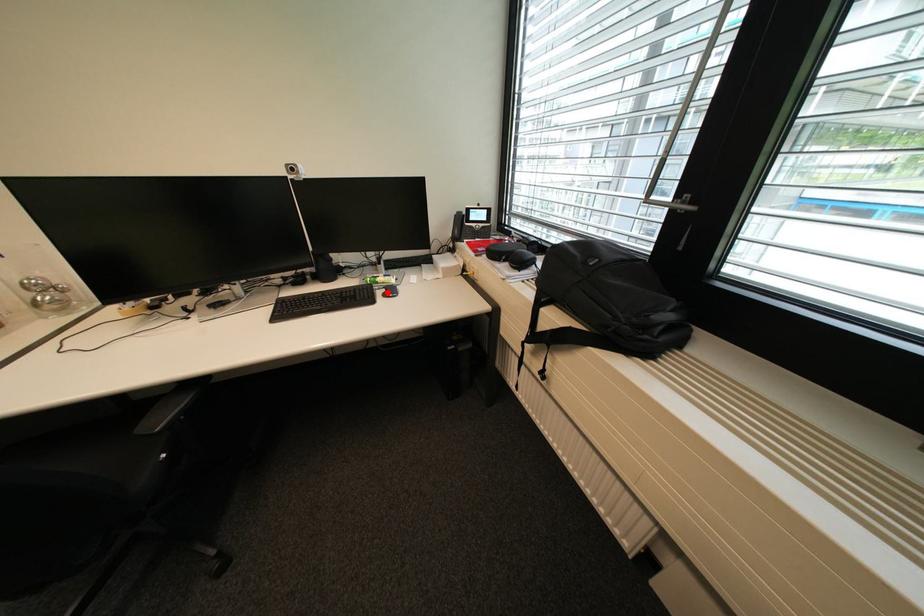
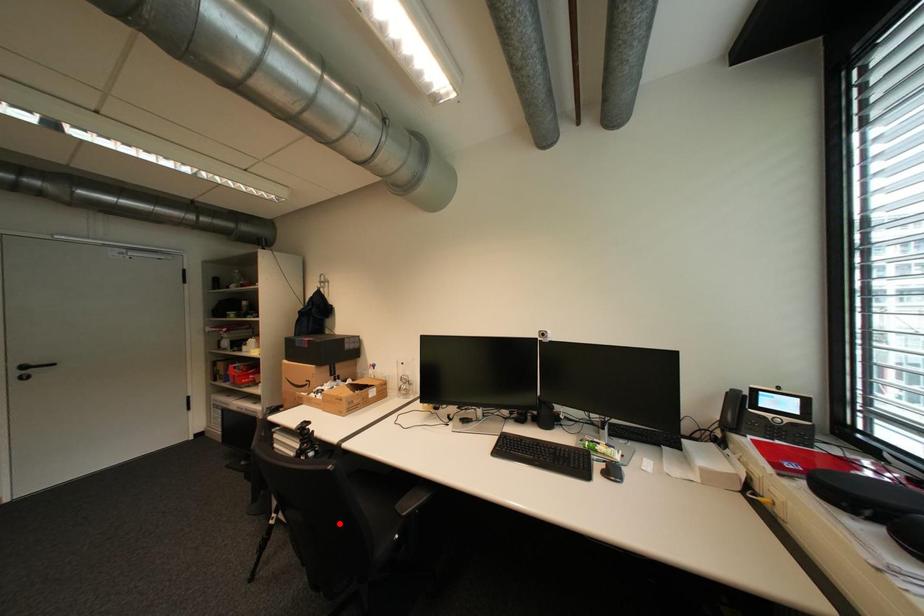
I am providing you with two images of the same scene from different viewpoints. A red point is marked on the first image and another point is marked on the second image. Do the highlighted points in image1 and image2 indicate the same real-world spot?

No